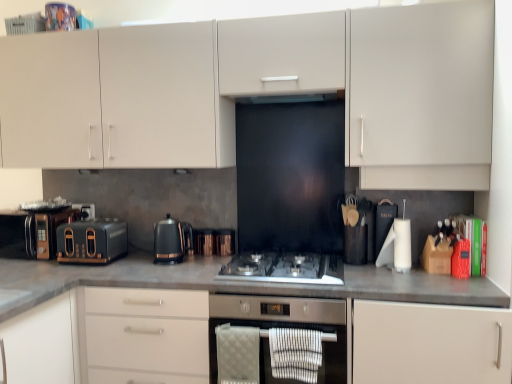
Where is `free space in front of metallic copper kettle at center, which is the third appliance in left-to-right order`? free space in front of metallic copper kettle at center, which is the third appliance in left-to-right order is located at coordinates (223, 256).